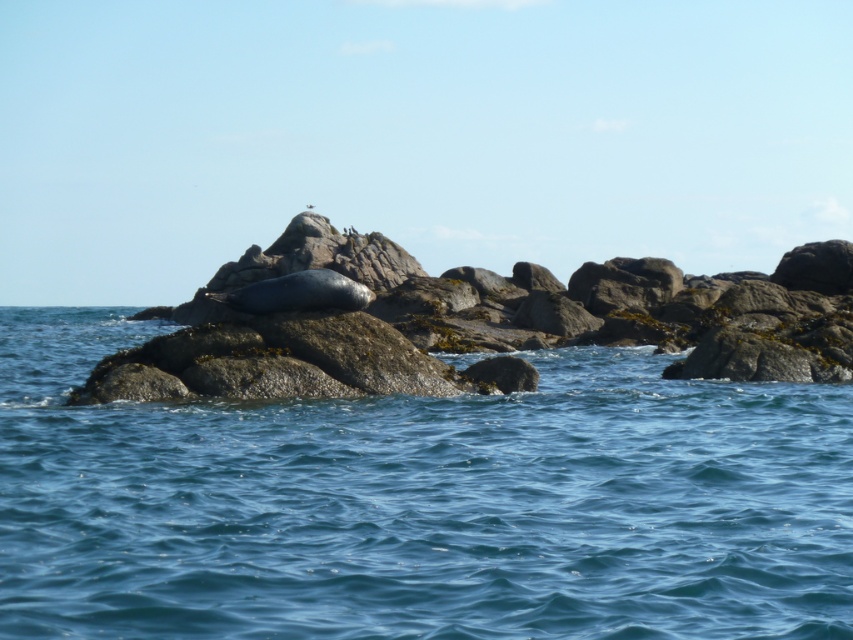
Question: Which point appears closest to the camera in this image?

Choices:
 (A) (294, 506)
 (B) (123, 380)

Answer: (A)

Question: Which point is closer to the camera taking this photo?

Choices:
 (A) (349, 284)
 (B) (231, 291)
 (C) (358, 598)

Answer: (C)

Question: Can you confirm if smooth gray rock at center is bigger than gray matte seal at center?

Choices:
 (A) yes
 (B) no

Answer: (A)

Question: Which of the following is the farthest from the observer?

Choices:
 (A) tap(339, 387)
 (B) tap(216, 296)

Answer: (B)

Question: Can you confirm if blue water at center is positioned below smooth gray rock at center?

Choices:
 (A) no
 (B) yes

Answer: (B)

Question: Is blue water at center thinner than gray matte seal at center?

Choices:
 (A) no
 (B) yes

Answer: (A)